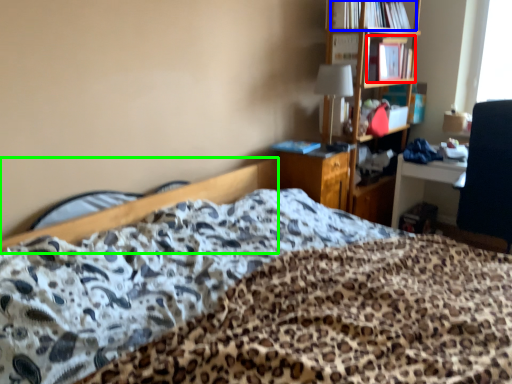
Question: Considering the real-world distances, which object is farthest from book (highlighted by a red box)? book (highlighted by a blue box) or bed frame (highlighted by a green box)?

Choices:
 (A) book
 (B) bed frame

Answer: (B)